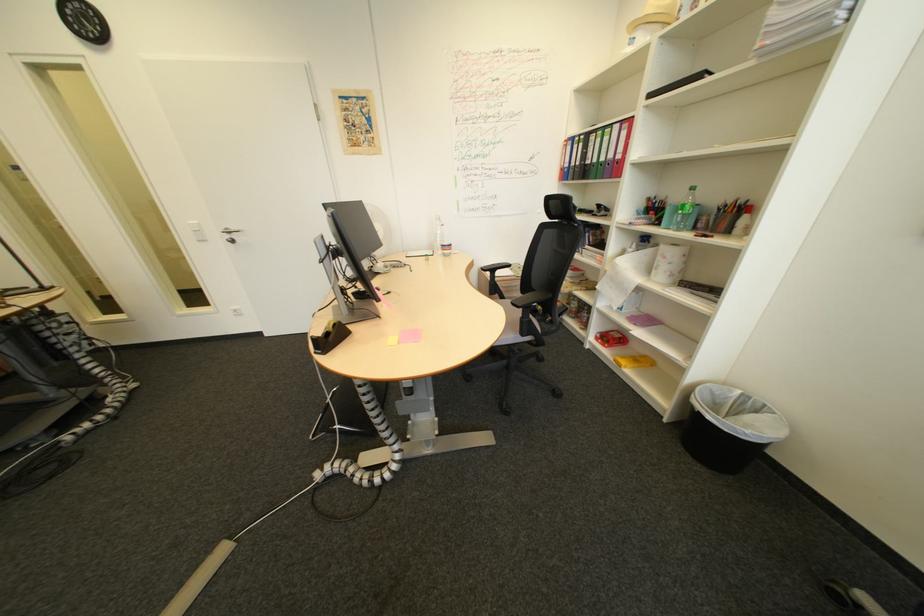
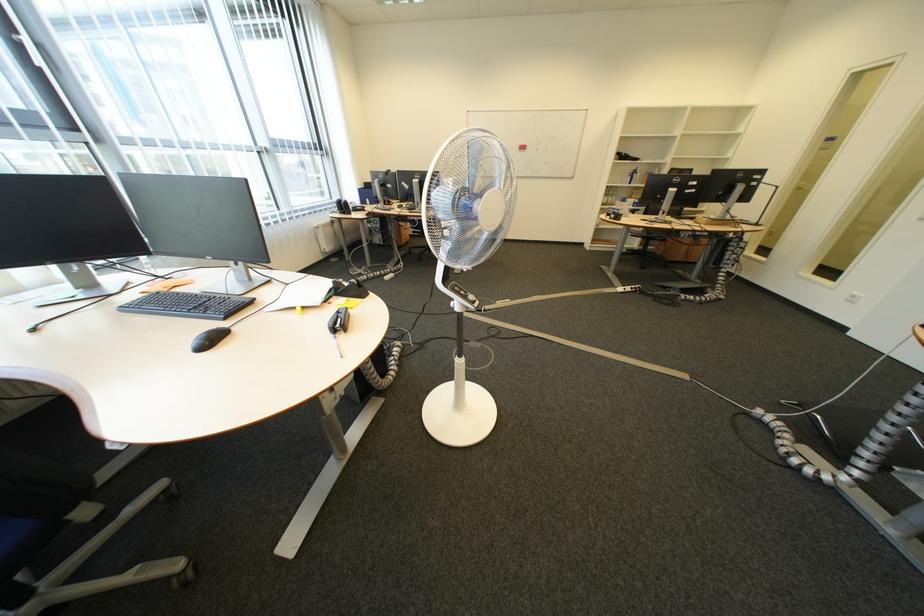
The first image is from the beginning of the video and the second image is from the end. How did the camera likely rotate when shooting the video?

The camera's rotation is toward left-down.